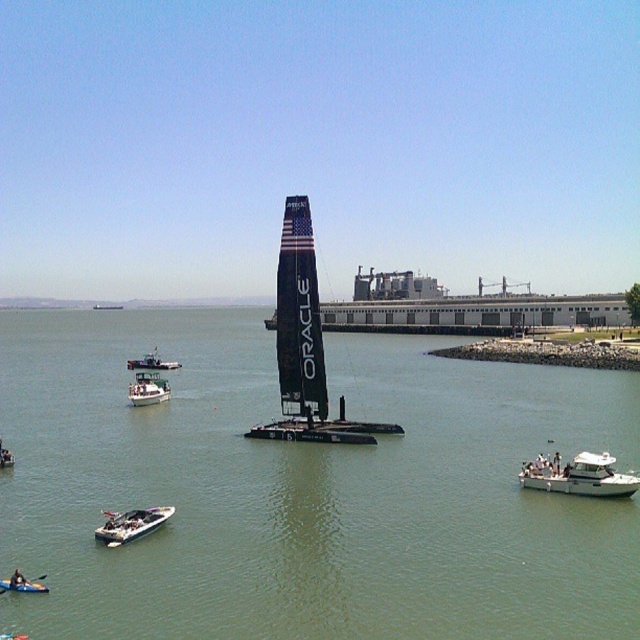
You are a photographer trying to capture the white glossy boat at left and the white glossy sailboat at center in a single shot. Based on their heights, which boat should you focus on to ensure both are fully visible in your frame?

The white glossy boat at left is shorter than the white glossy sailboat at center, so focusing on the taller sailboat at center will help ensure both are fully visible in the frame.

You are a photographer trying to capture both the dark blue wetsuit at lower left and the white plastic kayak at lower left in the same frame. Which object should you focus on first if you want to ensure both are in focus, considering their sizes?

The dark blue wetsuit at lower left is not as tall as the white plastic kayak at lower left, so you should focus on the white plastic kayak at lower left first since it is taller and will require more depth of field to capture both in focus.

You are a photographer planning to capture the dark blue wetsuit at lower left and the white plastic kayak at lower left in a single frame. Given their sizes, which object should you position closer to the camera to ensure both are visible in the frame without cropping?

The dark blue wetsuit at lower left is larger than the white plastic kayak at lower left. To include both in the frame without cropping, position the larger dark blue wetsuit at lower left closer to the camera so that its size matches the smaller kayak in the background.